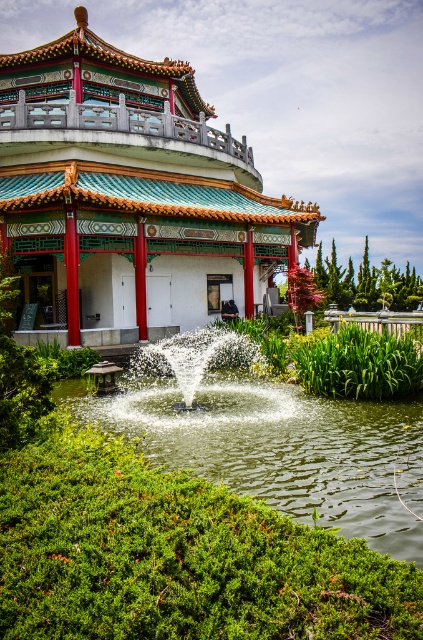
Question: Which object is closer to the camera taking this photo?

Choices:
 (A) green grassy lake at center
 (B) teal glazed tiles at center

Answer: (A)

Question: Can you confirm if teal glazed tiles at center is positioned below green grassy lake at center?

Choices:
 (A) yes
 (B) no

Answer: (B)

Question: Can you confirm if teal glazed tiles at center is positioned below green grassy lake at center?

Choices:
 (A) yes
 (B) no

Answer: (B)

Question: In this image, where is teal glazed tiles at center located relative to white frothy water at center?

Choices:
 (A) right
 (B) left

Answer: (B)

Question: Which is nearer to the green grassy lake at center?

Choices:
 (A) white frothy water at center
 (B) teal glazed tiles at center

Answer: (A)

Question: Estimate the real-world distances between objects in this image. Which object is closer to the teal glazed tiles at center?

Choices:
 (A) green grassy lake at center
 (B) white frothy water at center

Answer: (B)